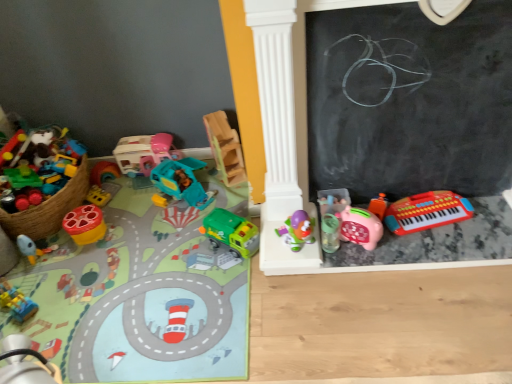
Where is `free space above matte plastic toy car at left, the fourth toy from the left (from a real-world perspective)`? free space above matte plastic toy car at left, the fourth toy from the left (from a real-world perspective) is located at coordinates (123, 258).